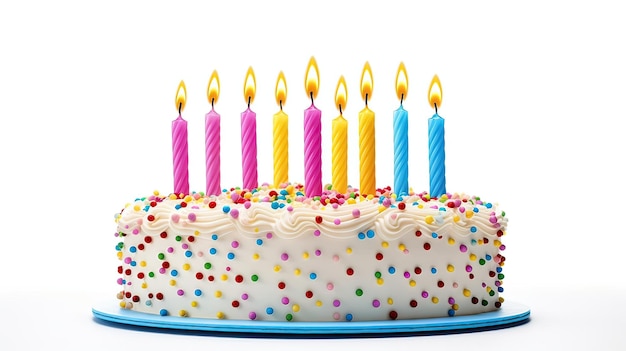
Identify the location of candles. The width and height of the screenshot is (626, 351). (437, 155), (403, 154), (367, 154), (347, 155), (317, 159), (275, 153), (247, 156), (212, 157), (177, 165).